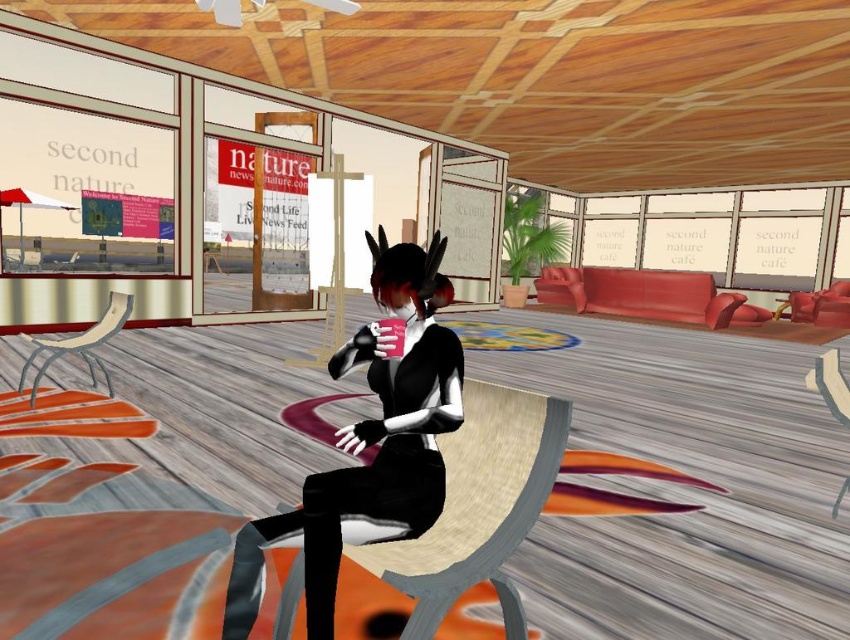
Who is taller, black matte dress at center or wooden textured chair at lower right?

Standing taller between the two is black matte dress at center.

Is point (418, 376) positioned before point (847, 484)?

Yes, point (418, 376) is in front of point (847, 484).

Does point (450, 394) come in front of point (842, 416)?

Yes, it is in front of point (842, 416).

Find the location of a particular element. black matte dress at center is located at coordinates (369, 444).

Is point (31, 340) closer to camera compared to point (75, 252)?

Yes, it is in front of point (75, 252).

Is point (40, 349) farther from camera compared to point (72, 268)?

No, (40, 349) is in front of (72, 268).

Find the location of a particular element. Image resolution: width=850 pixels, height=640 pixels. metallic silver chair at left is located at coordinates (78, 346).

Is point (340, 486) positioned in front of point (35, 342)?

Yes, it is in front of point (35, 342).

Is point (255, 566) closer to viewer compared to point (97, 381)?

Yes, it is.

Identify the location of black matte dress at center. The height and width of the screenshot is (640, 850). 369,444.